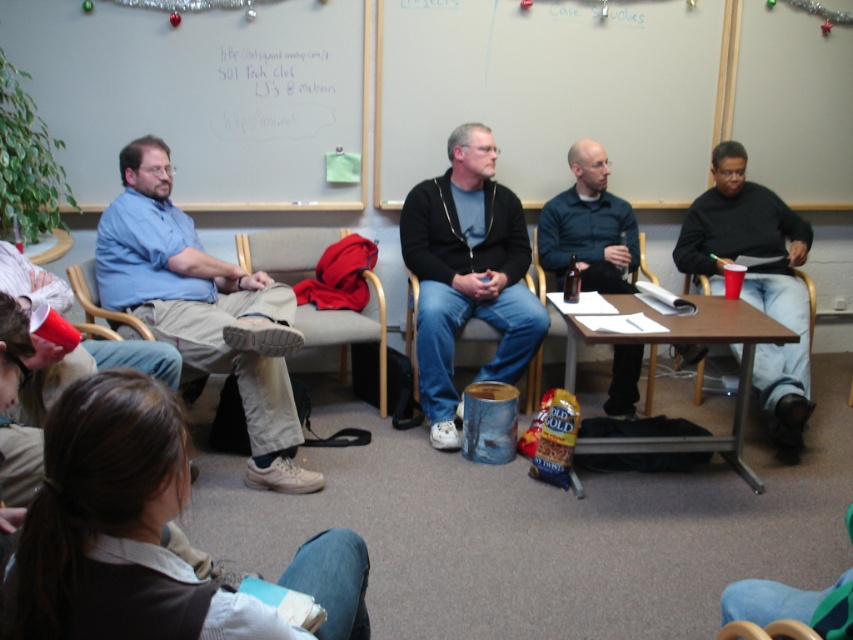
Question: Can you confirm if brown suede shoes at lower center is positioned above wooden armchair at lower right?

Choices:
 (A) yes
 (B) no

Answer: (A)

Question: Which point is closer to the camera?

Choices:
 (A) (622, 154)
 (B) (204, 321)
 (C) (809, 632)
 (D) (454, 180)

Answer: (C)

Question: Among these points, which one is farthest from the camera?

Choices:
 (A) (115, 257)
 (B) (90, 275)

Answer: (B)

Question: Is black zip-up jacket at center thinner than wooden armchair at lower right?

Choices:
 (A) no
 (B) yes

Answer: (A)

Question: Which point is farther to the camera?

Choices:
 (A) wooden armchair at lower right
 (B) wooden chair at left
 (C) light blue shirt at left

Answer: (C)

Question: Does black sweater at right lie in front of wooden armchair at lower right?

Choices:
 (A) no
 (B) yes

Answer: (A)